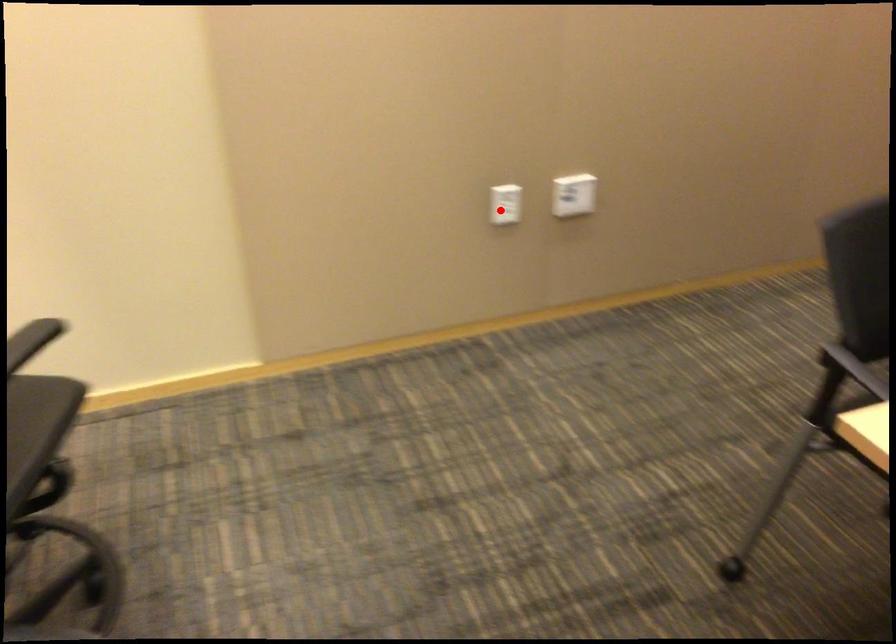
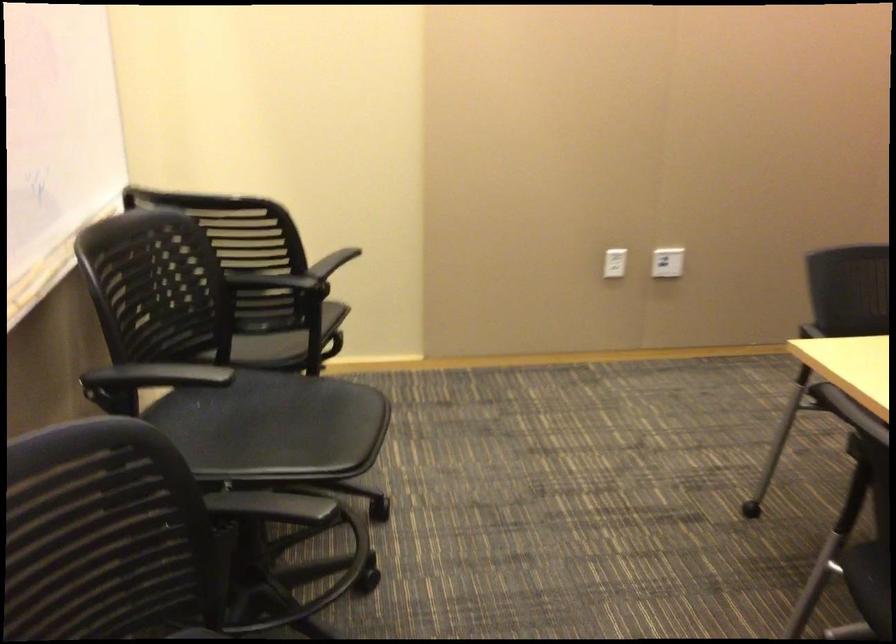
Find the pixel in the second image that matches the highlighted location in the first image.

(615, 263)